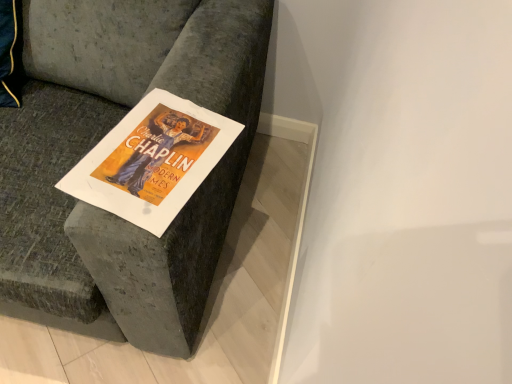
This screenshot has height=384, width=512. What do you see at coordinates (133, 105) in the screenshot?
I see `velvet gray couch at upper left` at bounding box center [133, 105].

What is the approximate width of velvet gray couch at upper left?

velvet gray couch at upper left is 38.62 inches in width.

Locate an element on the screen. This screenshot has height=384, width=512. velvet gray couch at upper left is located at coordinates (133, 105).

The width and height of the screenshot is (512, 384). What are the coordinates of `orange paper poster at center` in the screenshot? It's located at (152, 160).

What is the approximate width of orange paper poster at center?

It is 12.35 inches.

This screenshot has width=512, height=384. Describe the element at coordinates (152, 160) in the screenshot. I see `orange paper poster at center` at that location.

Where is `velvet gray couch at upper left`? The image size is (512, 384). velvet gray couch at upper left is located at coordinates (133, 105).

Is orange paper poster at center to the left or to the right of velvet gray couch at upper left in the image?

orange paper poster at center is positioned on velvet gray couch at upper left's right side.

Between orange paper poster at center and velvet gray couch at upper left, which one is positioned in front?

velvet gray couch at upper left is more forward.

Does point (160, 218) come closer to viewer compared to point (106, 217)?

Yes.

From the image's perspective, which one is positioned lower, orange paper poster at center or velvet gray couch at upper left?

orange paper poster at center.

From a real-world perspective, is orange paper poster at center physically above velvet gray couch at upper left?

Yes, from a real-world perspective, orange paper poster at center is over velvet gray couch at upper left

Can you confirm if orange paper poster at center is wider than velvet gray couch at upper left?

No.

Can you confirm if orange paper poster at center is shorter than velvet gray couch at upper left?

Indeed, orange paper poster at center has a lesser height compared to velvet gray couch at upper left.

Considering the sizes of objects orange paper poster at center and velvet gray couch at upper left in the image provided, who is smaller, orange paper poster at center or velvet gray couch at upper left?

orange paper poster at center is smaller.

Which is correct: orange paper poster at center is inside velvet gray couch at upper left, or outside of it?

The correct answer is: inside.

Is orange paper poster at center directly adjacent to velvet gray couch at upper left?

orange paper poster at center and velvet gray couch at upper left are clearly separated.

Is orange paper poster at center aimed at velvet gray couch at upper left?

Yes, orange paper poster at center is turned towards velvet gray couch at upper left.

What's the angular difference between orange paper poster at center and velvet gray couch at upper left's facing directions?

The angular difference between orange paper poster at center and velvet gray couch at upper left is 14 degrees.

Find the location of `furniture that is on the left side of orange paper poster at center`. furniture that is on the left side of orange paper poster at center is located at coordinates (133, 105).

Considering the relative positions of velvet gray couch at upper left and orange paper poster at center in the image provided, is velvet gray couch at upper left to the right of orange paper poster at center from the viewer's perspective?

→ In fact, velvet gray couch at upper left is to the left of orange paper poster at center.

Which object is more forward, velvet gray couch at upper left or orange paper poster at center?

Positioned in front is velvet gray couch at upper left.

Is point (242, 144) in front of point (81, 172)?

No, (242, 144) is behind (81, 172).

From the image's perspective, which is above, velvet gray couch at upper left or orange paper poster at center?

velvet gray couch at upper left.

From a real-world perspective, is velvet gray couch at upper left positioned above or below orange paper poster at center?

From a real-world perspective, velvet gray couch at upper left is physically below orange paper poster at center.

Considering the sizes of velvet gray couch at upper left and orange paper poster at center in the image, is velvet gray couch at upper left wider or thinner than orange paper poster at center?

In the image, velvet gray couch at upper left appears to be wider than orange paper poster at center.

Considering the relative sizes of velvet gray couch at upper left and orange paper poster at center in the image provided, is velvet gray couch at upper left taller than orange paper poster at center?

Correct, velvet gray couch at upper left is much taller as orange paper poster at center.

Between velvet gray couch at upper left and orange paper poster at center, which one has larger size?

Bigger between the two is velvet gray couch at upper left.

Does velvet gray couch at upper left contain orange paper poster at center?

Yes, orange paper poster at center is a part of velvet gray couch at upper left.

Is velvet gray couch at upper left in contact with orange paper poster at center?

There is a gap between velvet gray couch at upper left and orange paper poster at center.

Is velvet gray couch at upper left positioned with its back to orange paper poster at center?

velvet gray couch at upper left does not have its back to orange paper poster at center.

What's the angular difference between velvet gray couch at upper left and orange paper poster at center's facing directions?

14 degrees separate the facing orientations of velvet gray couch at upper left and orange paper poster at center.

I want to click on magazine lying behind the velvet gray couch at upper left, so click(x=152, y=160).

Locate an element on the screen. Image resolution: width=512 pixels, height=384 pixels. magazine that is above the velvet gray couch at upper left (from a real-world perspective) is located at coordinates (152, 160).

This screenshot has width=512, height=384. What are the coordinates of `magazine behind the velvet gray couch at upper left` in the screenshot? It's located at tap(152, 160).